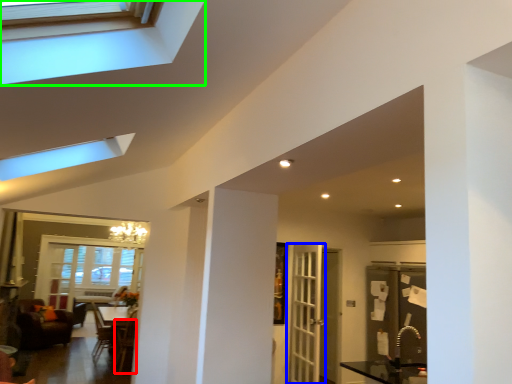
Question: Which object is positioned closest to armchair (highlighted by a red box)? Select from door (highlighted by a blue box) and window (highlighted by a green box).

Choices:
 (A) door
 (B) window

Answer: (A)